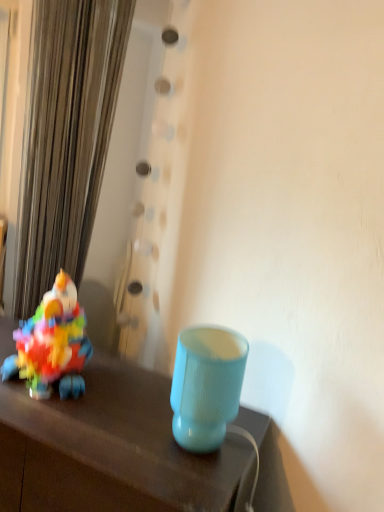
Question: Looking at their shapes, would you say metallic silver curtain at left is wider or thinner than multicolored plastic toy at left?

Choices:
 (A) thin
 (B) wide

Answer: (A)

Question: Is point (102, 33) closer or farther from the camera than point (34, 317)?

Choices:
 (A) farther
 (B) closer

Answer: (A)

Question: Considering the real-world distances, which object is farthest from the multicolored plastic toy at left?

Choices:
 (A) matte blue lampshade at center
 (B) matte plastic lamp at lower right
 (C) metallic silver curtain at left

Answer: (C)

Question: Estimate the real-world distances between objects in this image. Which object is closer to the matte blue lampshade at center?

Choices:
 (A) matte plastic lamp at lower right
 (B) multicolored plastic toy at left
 (C) metallic silver curtain at left

Answer: (A)